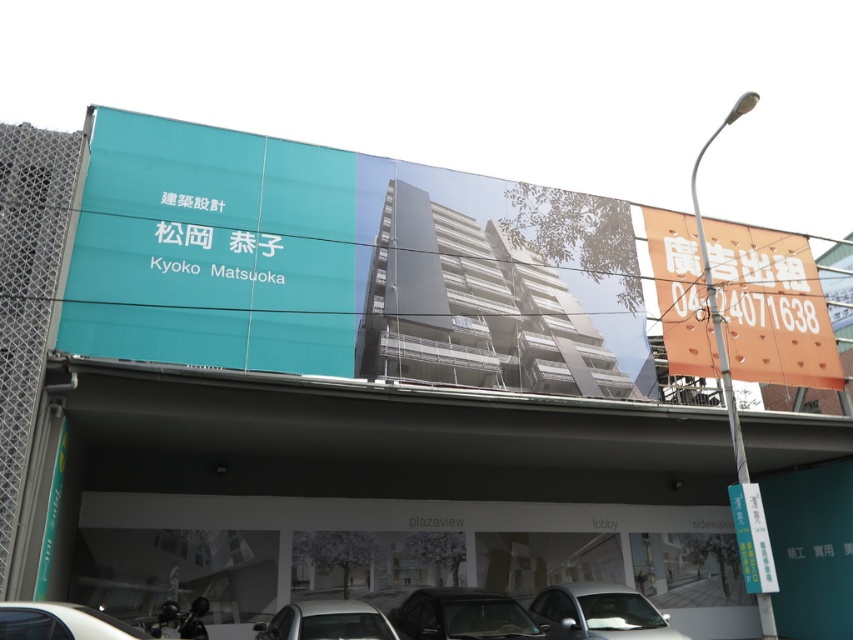
Between orange paper sign at right and white glossy car at lower left, which one is positioned higher?

orange paper sign at right is higher up.

Is orange paper sign at right taller than white glossy car at lower left?

Yes, orange paper sign at right is taller than white glossy car at lower left.

Is point (686, 323) positioned in front of point (85, 612)?

No, (686, 323) is behind (85, 612).

Locate an element on the screen. The width and height of the screenshot is (853, 640). orange paper sign at right is located at coordinates (770, 307).

At what (x,y) coordinates should I click in order to perform the action: click on silver metallic car at center. Please return your answer as a coordinate pair (x, y). This screenshot has height=640, width=853. Looking at the image, I should click on (326, 621).

Is silver metallic car at center closer to the viewer compared to yellow paper at lower right?

Yes, it is.

Where is `silver metallic car at center`? Image resolution: width=853 pixels, height=640 pixels. silver metallic car at center is located at coordinates (326, 621).

Can you confirm if orange paper sign at right is positioned to the left of silver metallic car at center?

No, orange paper sign at right is not to the left of silver metallic car at center.

Who is more forward, (817, 355) or (366, 634)?

Point (366, 634) is more forward.

This screenshot has width=853, height=640. In order to click on orange paper sign at right in this screenshot , I will do `click(770, 307)`.